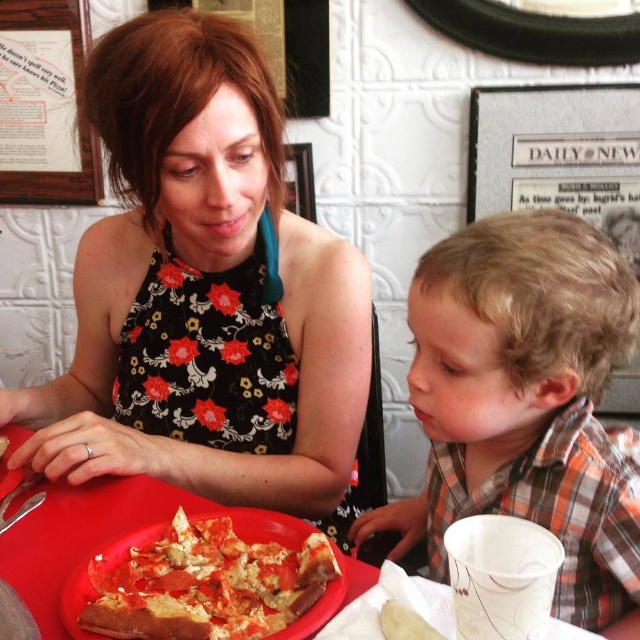
Question: Estimate the real-world distances between objects in this image. Which object is farther from the red plastic plate at center?

Choices:
 (A) crusty golden-brown pizza at center
 (B) plaid shirt at right

Answer: (B)

Question: Does plaid shirt at right appear on the left side of crusty golden-brown pizza at center?

Choices:
 (A) no
 (B) yes

Answer: (A)

Question: Which object is farther from the camera taking this photo?

Choices:
 (A) floral fabric dress at center
 (B) red plastic plate at center

Answer: (A)

Question: Does floral fabric dress at center have a greater width compared to red plastic plate at center?

Choices:
 (A) no
 (B) yes

Answer: (A)

Question: Is floral fabric dress at center positioned before red plastic plate at center?

Choices:
 (A) yes
 (B) no

Answer: (B)

Question: Which point appears farthest from the camera in this image?

Choices:
 (A) (189, 522)
 (B) (227, 380)
 (C) (577, 524)
 (D) (93, 513)

Answer: (B)